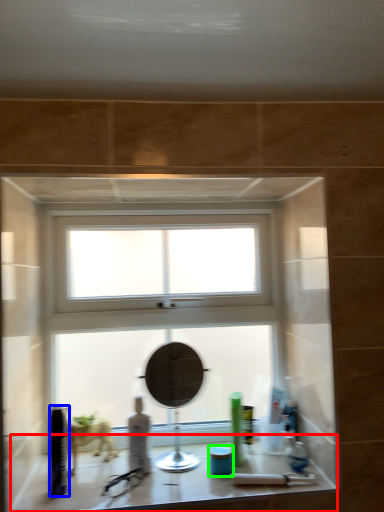
Question: Which is nearer to the counter top (highlighted by a red box)? toiletry (highlighted by a blue box) or toiletry (highlighted by a green box).

Choices:
 (A) toiletry
 (B) toiletry

Answer: (A)